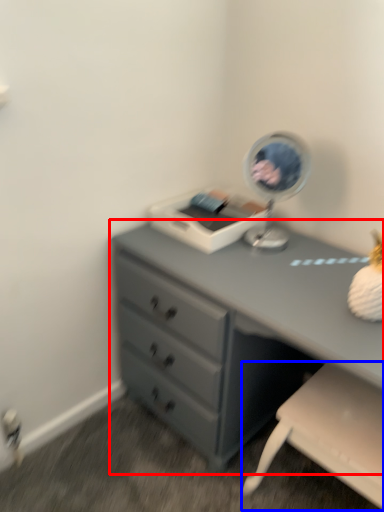
Question: Among these objects, which one is nearest to the camera, chest of drawers (highlighted by a red box) or swivel chair (highlighted by a blue box)?

Choices:
 (A) chest of drawers
 (B) swivel chair

Answer: (A)